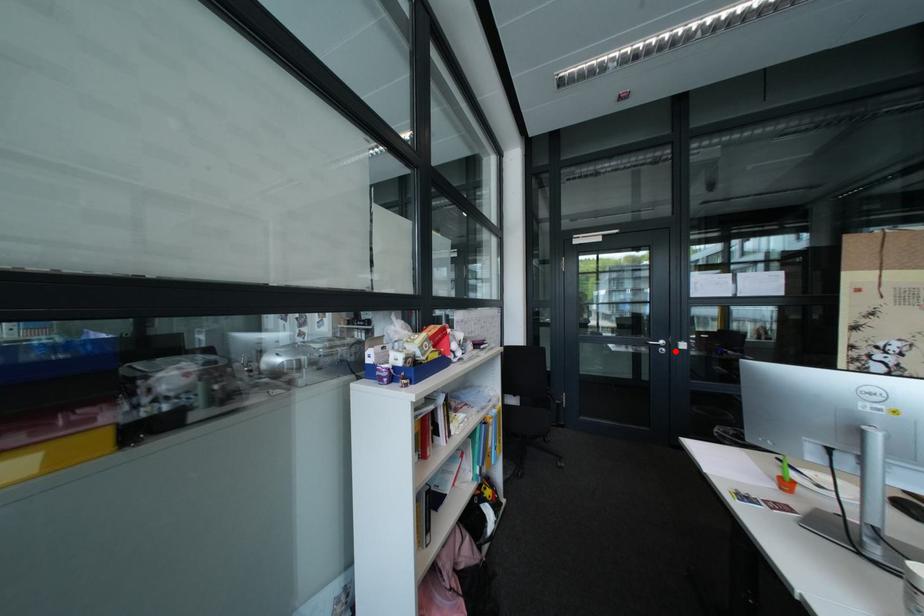
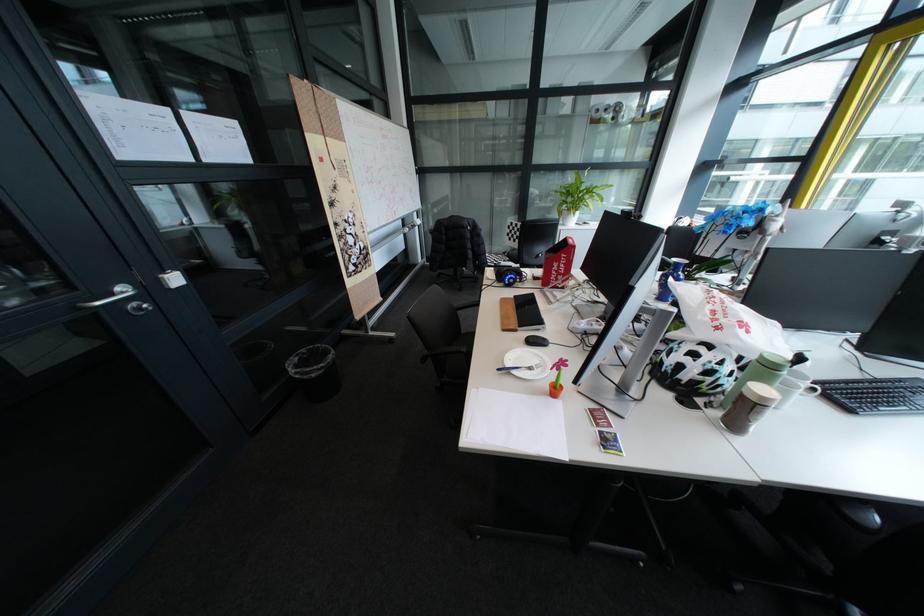
Find the pixel in the second image that matches the highlighted location in the first image.

(152, 309)